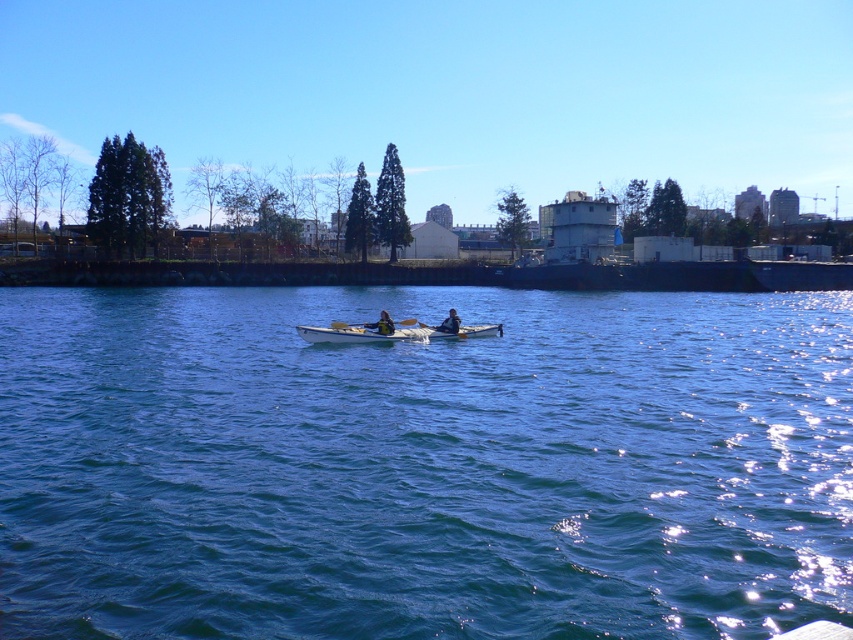
Is blue water at center thinner than white plastic paddle at center?

No, blue water at center is not thinner than white plastic paddle at center.

This screenshot has width=853, height=640. What are the coordinates of `blue water at center` in the screenshot? It's located at pyautogui.click(x=422, y=465).

What are the coordinates of `blue water at center` in the screenshot? It's located at (422, 465).

Can you confirm if white plastic boat at center is positioned to the left of matte black kayak at center?

Indeed, white plastic boat at center is positioned on the left side of matte black kayak at center.

Does point (300, 330) come in front of point (387, 332)?

Yes, it is in front of point (387, 332).

Where is `white plastic boat at center`? The width and height of the screenshot is (853, 640). white plastic boat at center is located at coordinates (392, 332).

Does blue water at center have a greater height compared to dark blue fabric jacket at center?

Yes, blue water at center is taller than dark blue fabric jacket at center.

Who is more distant from viewer, [225,557] or [457,332]?

Positioned behind is point [457,332].

Is point (352, 593) behind point (439, 328)?

That is False.

The width and height of the screenshot is (853, 640). Identify the location of blue water at center. (422, 465).